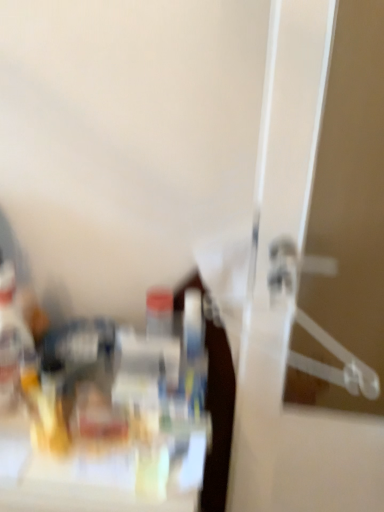
This screenshot has width=384, height=512. In order to click on translucent plastic bottle at left in this screenshot , I will do `click(11, 340)`.

The image size is (384, 512). What do you see at coordinates (11, 340) in the screenshot?
I see `translucent plastic bottle at left` at bounding box center [11, 340].

Locate an element on the screen. The height and width of the screenshot is (512, 384). clear plastic hanger at right is located at coordinates (314, 322).

What do you see at coordinates (314, 322) in the screenshot? I see `clear plastic hanger at right` at bounding box center [314, 322].

At what (x,y) coordinates should I click in order to perform the action: click on translucent plastic bottle at left. Please return your answer as a coordinate pair (x, y). Image resolution: width=384 pixels, height=512 pixels. Looking at the image, I should click on (11, 340).

Based on their positions, is translucent plastic bottle at left located to the left or right of clear plastic hanger at right?

Based on their positions, translucent plastic bottle at left is located to the left of clear plastic hanger at right.

Which object is further away from the camera, translucent plastic bottle at left or clear plastic hanger at right?

translucent plastic bottle at left is further from the camera.

Does point (1, 361) come behind point (292, 356)?

No, (1, 361) is closer to viewer.

From the image's perspective, relative to clear plastic hanger at right, is translucent plastic bottle at left above or below?

Clearly, from the image's perspective, translucent plastic bottle at left is below clear plastic hanger at right.

From a real-world perspective, is translucent plastic bottle at left on top of clear plastic hanger at right?

No, from a real-world perspective, translucent plastic bottle at left is not above clear plastic hanger at right.

In the scene shown: Is translucent plastic bottle at left wider or thinner than clear plastic hanger at right?

Considering their sizes, translucent plastic bottle at left looks broader than clear plastic hanger at right.

Considering the relative sizes of translucent plastic bottle at left and clear plastic hanger at right in the image provided, is translucent plastic bottle at left shorter than clear plastic hanger at right?

In fact, translucent plastic bottle at left may be taller than clear plastic hanger at right.

Is translucent plastic bottle at left bigger or smaller than clear plastic hanger at right?

Considering their sizes, translucent plastic bottle at left takes up less space than clear plastic hanger at right.

Is translucent plastic bottle at left completely or partially outside of clear plastic hanger at right?

Yes, translucent plastic bottle at left is not within clear plastic hanger at right.

Is translucent plastic bottle at left far away from clear plastic hanger at right?

No, there isn't a large distance between translucent plastic bottle at left and clear plastic hanger at right.

Is translucent plastic bottle at left facing away from clear plastic hanger at right?

No, clear plastic hanger at right is not at the back of translucent plastic bottle at left.

How many degrees apart are the facing directions of translucent plastic bottle at left and clear plastic hanger at right?

translucent plastic bottle at left and clear plastic hanger at right are facing 37.7 degrees away from each other.

The width and height of the screenshot is (384, 512). I want to click on bottle located on the left of clear plastic hanger at right, so click(11, 340).

Which object is positioned more to the right, clear plastic hanger at right or translucent plastic bottle at left?

clear plastic hanger at right.

Is clear plastic hanger at right further to the viewer compared to translucent plastic bottle at left?

No.

Does point (322, 330) lie behind point (8, 287)?

No, (322, 330) is closer to viewer.

From the image's perspective, is clear plastic hanger at right under translucent plastic bottle at left?

No, from the image's perspective, clear plastic hanger at right is not below translucent plastic bottle at left.

From a real-world perspective, is clear plastic hanger at right physically located above or below translucent plastic bottle at left?

Clearly, from a real-world perspective, clear plastic hanger at right is above translucent plastic bottle at left.

Which of these two, clear plastic hanger at right or translucent plastic bottle at left, is wider?

translucent plastic bottle at left is wider.

Which of these two, clear plastic hanger at right or translucent plastic bottle at left, stands shorter?

Standing shorter between the two is clear plastic hanger at right.

Who is bigger, clear plastic hanger at right or translucent plastic bottle at left?

With larger size is clear plastic hanger at right.

Is translucent plastic bottle at left a part of clear plastic hanger at right?

No, clear plastic hanger at right does not contain translucent plastic bottle at left.

Is clear plastic hanger at right beside translucent plastic bottle at left?

A: clear plastic hanger at right and translucent plastic bottle at left are clearly separated.

Is clear plastic hanger at right facing towards translucent plastic bottle at left?

No.

Can you tell me how much clear plastic hanger at right and translucent plastic bottle at left differ in facing direction?

They differ by 37.7 degrees in their facing directions.

Identify the location of hanger above the translucent plastic bottle at left (from the image's perspective). Image resolution: width=384 pixels, height=512 pixels. (314, 322).

In the image, there is a clear plastic hanger at right. Find the location of `bottle below it (from a real-world perspective)`. bottle below it (from a real-world perspective) is located at coordinates (11, 340).

Locate an element on the screen. hanger above the translucent plastic bottle at left (from the image's perspective) is located at coordinates (314, 322).